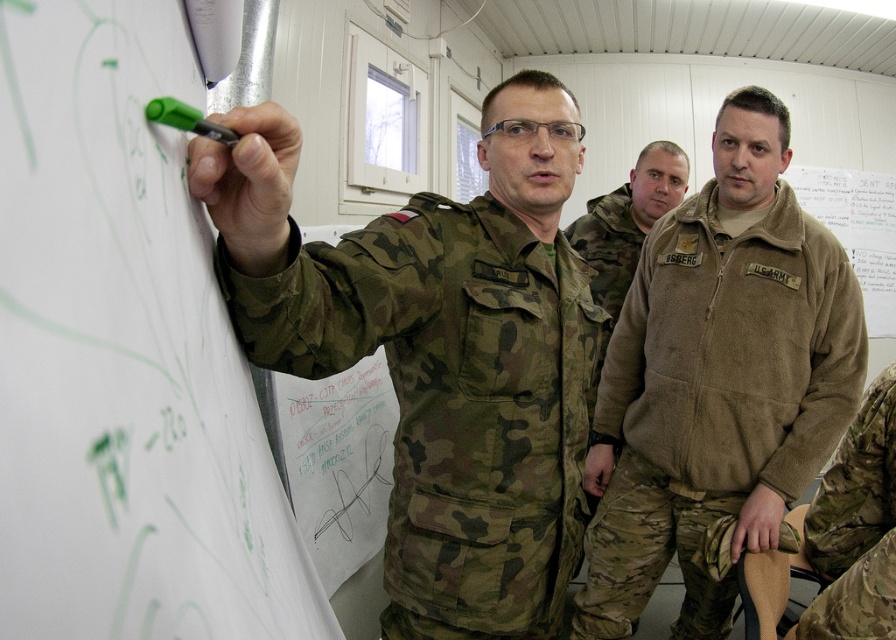
Does point (110, 374) come behind point (392, 262)?

No, it is in front of (392, 262).

Is green matte marker at upper left further to the viewer compared to camo uniform at center?

That is False.

Does point (162, 445) come in front of point (412, 557)?

Yes, point (162, 445) is in front of point (412, 557).

Where is `green matte marker at upper left`? The height and width of the screenshot is (640, 896). green matte marker at upper left is located at coordinates (125, 356).

Is suede brown jacket at center shorter than camouflage fabric jacket at center?

No, suede brown jacket at center is not shorter than camouflage fabric jacket at center.

Is suede brown jacket at center behind camouflage fabric jacket at center?

No, it is not.

Where is `suede brown jacket at center`? This screenshot has width=896, height=640. suede brown jacket at center is located at coordinates (717, 380).

Does point (580, 426) come closer to viewer compared to point (731, 129)?

That is True.

From the picture: Can you confirm if camo uniform at center is wider than suede brown jacket at center?

In fact, camo uniform at center might be narrower than suede brown jacket at center.

This screenshot has width=896, height=640. Identify the location of camo uniform at center. (438, 352).